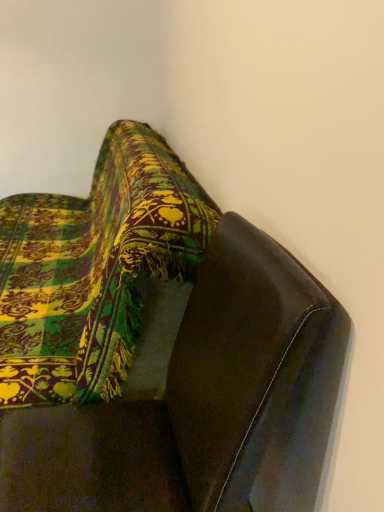
The width and height of the screenshot is (384, 512). What do you see at coordinates (159, 349) in the screenshot? I see `leather couch at upper left` at bounding box center [159, 349].

Locate an element on the screen. leather couch at upper left is located at coordinates (159, 349).

Identify the location of leather couch at upper left. The height and width of the screenshot is (512, 384). (159, 349).